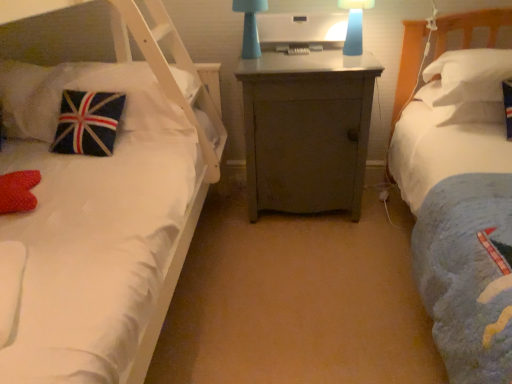
Question: From a real-world perspective, is gray matte cabinet at center physically located above or below velvet union jack pillow at left, which is counted as the 1th pillow, starting from the left?

Choices:
 (A) below
 (B) above

Answer: (A)

Question: Is gray matte cabinet at center bigger or smaller than velvet union jack pillow at left, which is counted as the 1th pillow, starting from the left?

Choices:
 (A) big
 (B) small

Answer: (A)

Question: Estimate the real-world distances between objects in this image. Which object is closer to the matte blue lamp at center, the second bedside lamp when ordered from right to left?

Choices:
 (A) white soft pillow at right, placed as the second pillow when sorted from left to right
 (B) white soft pillow at right, the third pillow when ordered from left to right
 (C) blue matte lampshade at upper center, which ranks as the second bedside lamp in left-to-right order
 (D) velvet union jack pillow at left, positioned as the 3th pillow in right-to-left order
 (E) gray matte cabinet at center

Answer: (E)

Question: Estimate the real-world distances between objects in this image. Which object is farther from the gray matte cabinet at center?

Choices:
 (A) matte blue lamp at center, the second bedside lamp when ordered from right to left
 (B) velvet union jack pillow at left, positioned as the 3th pillow in right-to-left order
 (C) white soft pillow at right, placed as the second pillow when sorted from left to right
 (D) white soft pillow at right, the third pillow when ordered from left to right
 (E) blue matte lampshade at upper center, which is counted as the first bedside lamp, starting from the right

Answer: (B)